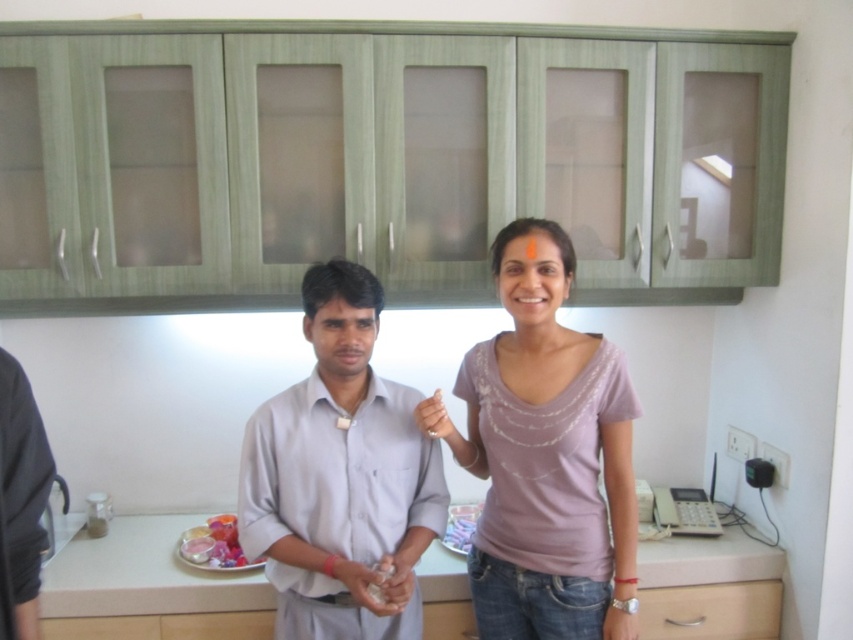
Does purple matte shirt at center have a greater width compared to glossy plastic containers at lower center?

Yes, purple matte shirt at center is wider than glossy plastic containers at lower center.

Who is taller, purple matte shirt at center or glossy plastic containers at lower center?

Standing taller between the two is purple matte shirt at center.

Is point (509, 253) positioned before point (228, 541)?

Yes.

The width and height of the screenshot is (853, 640). I want to click on purple matte shirt at center, so click(547, 458).

Measure the distance between purple matte shirt at center and light gray cotton shirt at center.

A distance of 26.69 centimeters exists between purple matte shirt at center and light gray cotton shirt at center.

In order to click on purple matte shirt at center in this screenshot , I will do `click(547, 458)`.

Is light gray cotton shirt at center above white matte hand at center?

No, light gray cotton shirt at center is not above white matte hand at center.

Who is positioned more to the right, light gray cotton shirt at center or white matte hand at center?

white matte hand at center is more to the right.

Describe the element at coordinates (340, 476) in the screenshot. I see `light gray cotton shirt at center` at that location.

At what (x,y) coordinates should I click in order to perform the action: click on light gray cotton shirt at center. Please return your answer as a coordinate pair (x, y). Looking at the image, I should click on (340, 476).